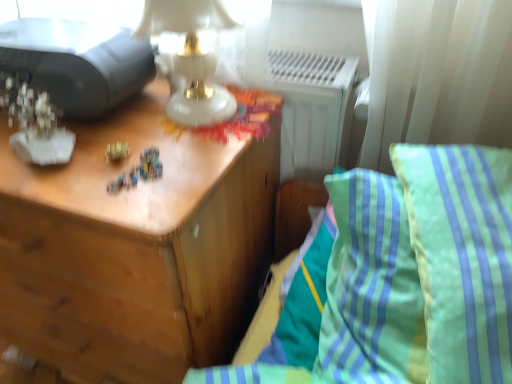
Question: Is green striped pillow at right surrounded by green striped pillow at right?

Choices:
 (A) yes
 (B) no

Answer: (A)

Question: Is green striped pillow at right to the left of green striped pillow at right from the viewer's perspective?

Choices:
 (A) no
 (B) yes

Answer: (A)

Question: Is green striped pillow at right closer to camera compared to green striped pillow at right?

Choices:
 (A) yes
 (B) no

Answer: (B)

Question: Is green striped pillow at right oriented towards green striped pillow at right?

Choices:
 (A) no
 (B) yes

Answer: (B)

Question: Is green striped pillow at right next to green striped pillow at right and touching it?

Choices:
 (A) no
 (B) yes

Answer: (B)

Question: From a real-world perspective, is green striped pillow at right positioned above or below green striped pillow at right?

Choices:
 (A) above
 (B) below

Answer: (A)

Question: Is green striped pillow at right bigger or smaller than green striped pillow at right?

Choices:
 (A) big
 (B) small

Answer: (B)

Question: Is point (x=456, y=344) positioned closer to the camera than point (x=373, y=216)?

Choices:
 (A) closer
 (B) farther

Answer: (A)

Question: Relative to green striped pillow at right, is green striped pillow at right in front or behind?

Choices:
 (A) front
 (B) behind

Answer: (B)

Question: Is green striped pillow at right inside or outside of matte black printer at upper left?

Choices:
 (A) inside
 (B) outside

Answer: (B)

Question: Is point (443, 170) closer or farther from the camera than point (150, 79)?

Choices:
 (A) farther
 (B) closer

Answer: (B)

Question: Is green striped pillow at right in front of or behind matte black printer at upper left in the image?

Choices:
 (A) front
 (B) behind

Answer: (A)

Question: Considering the positions of green striped pillow at right and matte black printer at upper left in the image, is green striped pillow at right taller or shorter than matte black printer at upper left?

Choices:
 (A) tall
 (B) short

Answer: (A)

Question: Relative to wooden nightstand at left, is green striped pillow at right in front or behind?

Choices:
 (A) front
 (B) behind

Answer: (A)

Question: From the image's perspective, is green striped pillow at right above or below wooden nightstand at left?

Choices:
 (A) below
 (B) above

Answer: (B)